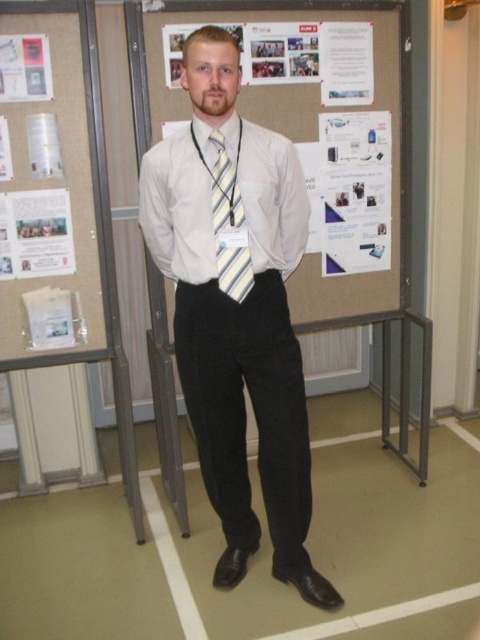
Question: Is matte paperboard at center smaller than matte paper poster at upper left?

Choices:
 (A) yes
 (B) no

Answer: (B)

Question: Which object is farther from the camera taking this photo?

Choices:
 (A) matte paper poster at upper left
 (B) matte paperboard at center

Answer: (B)

Question: Is white smooth shirt at center in front of white smooth dress shirt at center?

Choices:
 (A) no
 (B) yes

Answer: (B)

Question: Estimate the real-world distances between objects in this image. Which object is closer to the yellow striped tie at center?

Choices:
 (A) matte paperboard at center
 (B) white smooth dress shirt at center
 (C) matte paper poster at left
 (D) matte paper poster at upper left

Answer: (B)

Question: Among these points, which one is farthest from the camera?

Choices:
 (A) (7, 44)
 (B) (228, 269)

Answer: (A)

Question: Can you confirm if white smooth shirt at center is positioned to the right of matte paper poster at left?

Choices:
 (A) yes
 (B) no

Answer: (A)